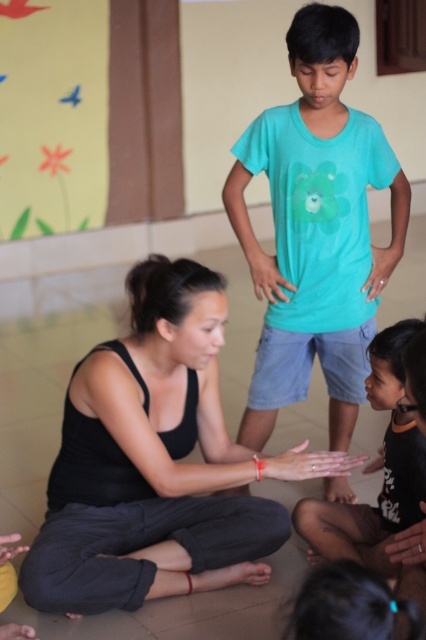
Between black matte tank top at center and dark brown skin at lower right, which one has more height?

Standing taller between the two is black matte tank top at center.

Is black matte tank top at center closer to camera compared to dark brown skin at lower right?

No.

Is point (28, 596) more distant than point (376, 509)?

No, it is in front of (376, 509).

Find the location of `black matte tank top at center`. black matte tank top at center is located at coordinates (157, 461).

Locate an element on the screen. The image size is (426, 640). black matte tank top at center is located at coordinates (157, 461).

Can you confirm if black matte tank top at center is smaller than turquoise cotton shirt at center?

Yes.

Locate an element on the screen. black matte tank top at center is located at coordinates (157, 461).

Is point (376, 284) in front of point (374, 372)?

No, (376, 284) is behind (374, 372).

Does turquoise cotton shirt at center appear over dark brown skin at lower right?

Correct, turquoise cotton shirt at center is located above dark brown skin at lower right.

Who is more forward, (325,74) or (389,529)?

Point (389,529)

At what (x,y) coordinates should I click in order to perform the action: click on turquoise cotton shirt at center. Please return your answer as a coordinate pair (x, y). This screenshot has height=640, width=426. Looking at the image, I should click on (316, 228).